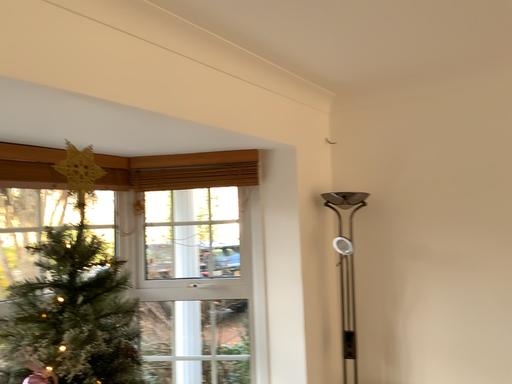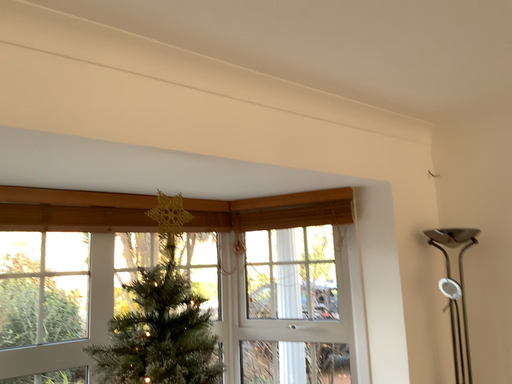
Question: How did the camera likely rotate when shooting the video?

Choices:
 (A) rotated right
 (B) rotated left

Answer: (B)